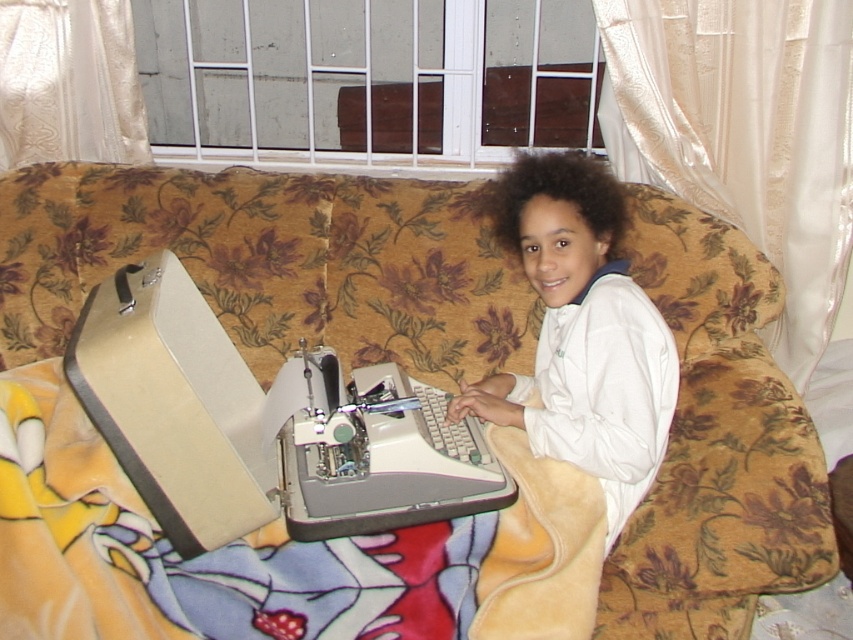
Is point (392, 339) closer to camera compared to point (532, 433)?

No, (392, 339) is behind (532, 433).

Is floral fabric couch at center bigger than white fleece at upper right?

Yes, floral fabric couch at center is bigger than white fleece at upper right.

Is point (62, 337) less distant than point (598, 440)?

No, it is not.

Locate an element on the screen. Image resolution: width=853 pixels, height=640 pixels. floral fabric couch at center is located at coordinates (425, 380).

What do you see at coordinates (425, 380) in the screenshot? This screenshot has height=640, width=853. I see `floral fabric couch at center` at bounding box center [425, 380].

Is floral fabric couch at center wider than beige fabric sewing machine at center?

Correct, the width of floral fabric couch at center exceeds that of beige fabric sewing machine at center.

Is point (49, 390) positioned after point (322, 518)?

Yes, point (49, 390) is behind point (322, 518).

Where is `floral fabric couch at center`? The height and width of the screenshot is (640, 853). floral fabric couch at center is located at coordinates (425, 380).

Who is taller, yellow fleece blanket at lower left or white fleece at upper right?

Standing taller between the two is white fleece at upper right.

Between yellow fleece blanket at lower left and white fleece at upper right, which one appears on the right side from the viewer's perspective?

white fleece at upper right is more to the right.

Does point (221, 630) come behind point (543, 404)?

No, (221, 630) is closer to viewer.

This screenshot has height=640, width=853. I want to click on yellow fleece blanket at lower left, so click(196, 556).